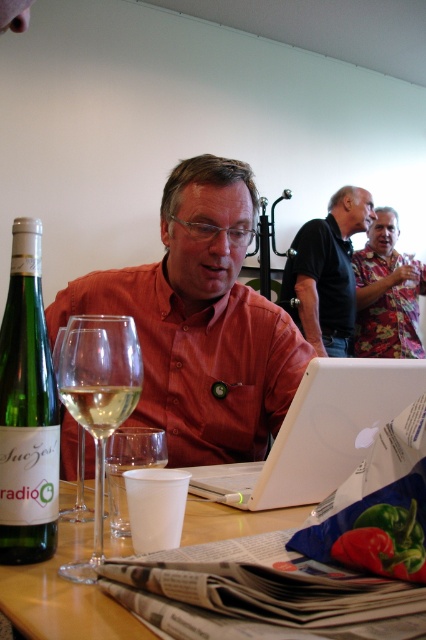
Is wooden table at center positioned at the back of clear glass wine glass at table center?

No.

Does wooden table at center appear on the right side of clear glass wine glass at table center?

Yes, wooden table at center is to the right of clear glass wine glass at table center.

Is point (114, 616) closer to viewer compared to point (140, 452)?

Yes, point (114, 616) is closer to viewer.

The width and height of the screenshot is (426, 640). What are the coordinates of `wooden table at center` in the screenshot? It's located at (63, 596).

Which is more to the left, matte orange shirt at center or clear glass wine glass at table center?

clear glass wine glass at table center

Looking at this image, does matte orange shirt at center have a larger size compared to clear glass wine glass at table center?

Yes.

Find the location of a particular element. matte orange shirt at center is located at coordinates (201, 321).

Can you confirm if white plastic laptop at center is taller than clear glass wine glass at left?

In fact, white plastic laptop at center may be shorter than clear glass wine glass at left.

What do you see at coordinates (317, 433) in the screenshot? I see `white plastic laptop at center` at bounding box center [317, 433].

What are the coordinates of `white plastic laptop at center` in the screenshot? It's located at tap(317, 433).